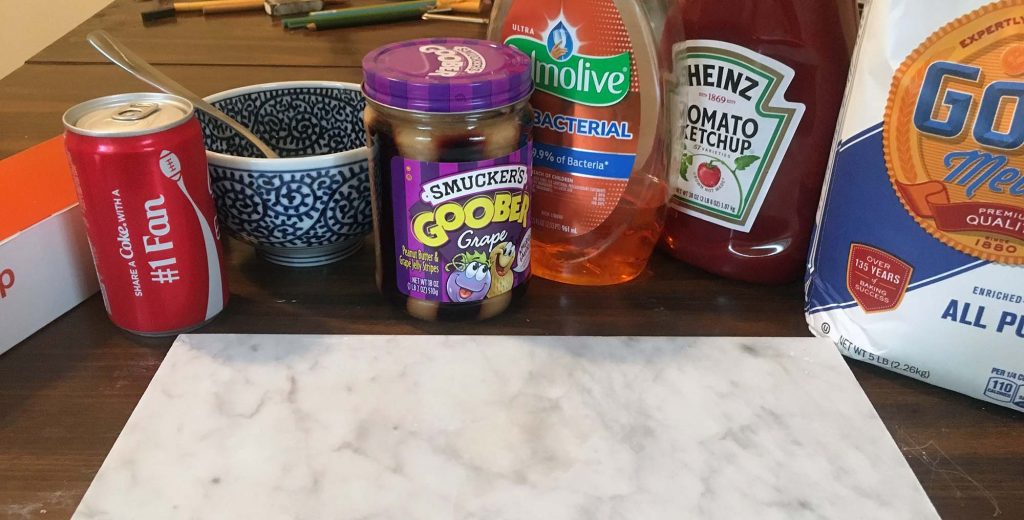
The width and height of the screenshot is (1024, 520). Identify the location of utensil. (150, 73).